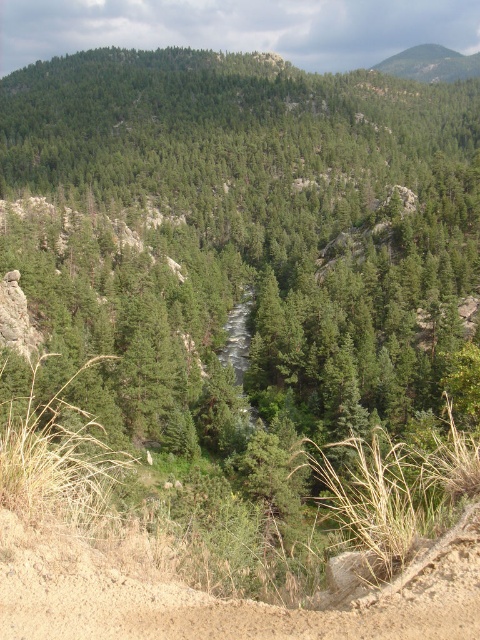
You are hiking and need to decide whether to take the brown sandy dirt track at lower left or the green textured rock at upper right. Which path is more accessible for your hiking boots?

The brown sandy dirt track at lower left is closer to the viewer than the green textured rock at upper right, so it is more accessible for your hiking boots.

You are a hiker planning to walk from the brown sandy dirt track at lower left to the green textured rock at upper right. Based on the scene description, which path would require climbing upwards?

The path to the green textured rock at upper right requires climbing upwards since it is higher in elevation than the brown sandy dirt track at lower left.

You are hiking and need to cross the river. You see a brown sandy dirt track at lower left and a green textured rock at upper right. Which path has a narrower width for crossing?

The brown sandy dirt track at lower left has a lesser width compared to the green textured rock at upper right, so the brown sandy dirt track at lower left is narrower for crossing.